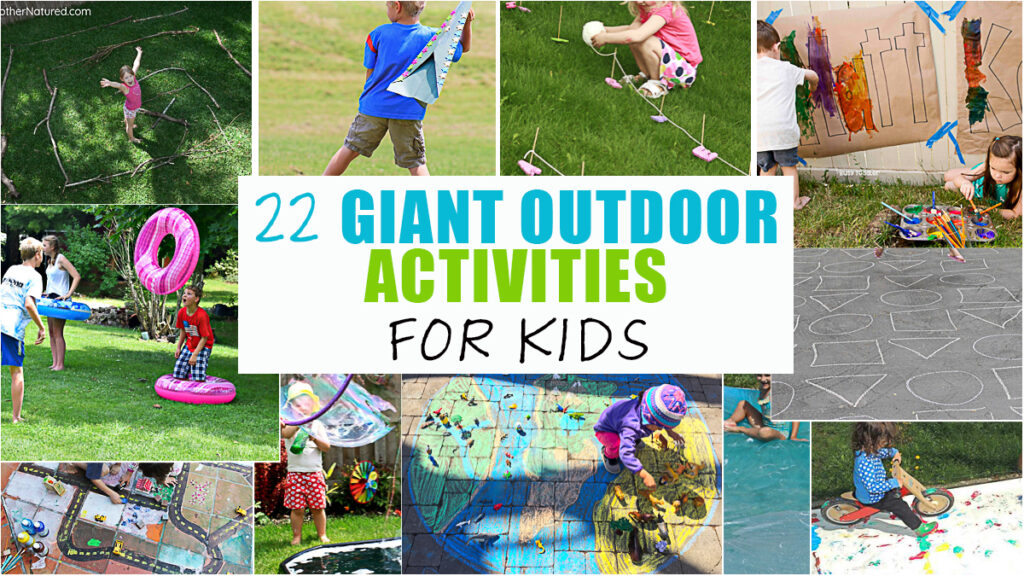
Identify the location of painting from child. (857, 75).